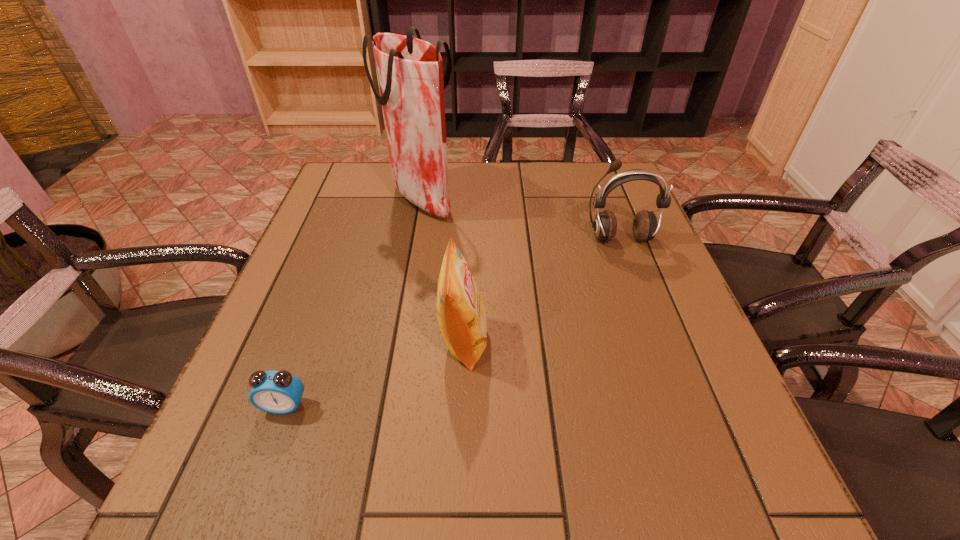
You are a GUI agent. You are given a task and a screenshot of the screen. Output one action in this format:
    pyautogui.click(x=<x>, y=<y>)
    Task: Click on the tallest object
    
    Given the screenshot: What is the action you would take?
    pyautogui.click(x=410, y=71)

Locate an element on the screen. grocery bag is located at coordinates (410, 71).

I want to click on the second farthest object, so click(x=645, y=226).

Locate an element on the screen. The image size is (960, 540). earphone is located at coordinates (645, 226).

Find the location of a particular element. Image resolution: width=960 pixels, height=540 pixels. crisp (potato chip) is located at coordinates (461, 313).

Locate an element on the screen. the shortest object is located at coordinates (279, 392).

Locate an element on the screen. the leftmost object is located at coordinates (279, 392).

Locate an element on the screen. This screenshot has height=540, width=960. free region located 0.190m on the front of the farthest object is located at coordinates (408, 273).

You are a GUI agent. You are given a task and a screenshot of the screen. Output one action in this format:
    pyautogui.click(x=<x>, y=<y>)
    Task: Click on the free space located 0.330m on the ear pads of the earphone
    Image resolution: width=960 pixels, height=540 pixels.
    Given the screenshot: What is the action you would take?
    pyautogui.click(x=665, y=363)

This screenshot has width=960, height=540. Find the location of `vacant area situated 0.230m on the front-facing side of the crisp (potato chip)`. vacant area situated 0.230m on the front-facing side of the crisp (potato chip) is located at coordinates (606, 341).